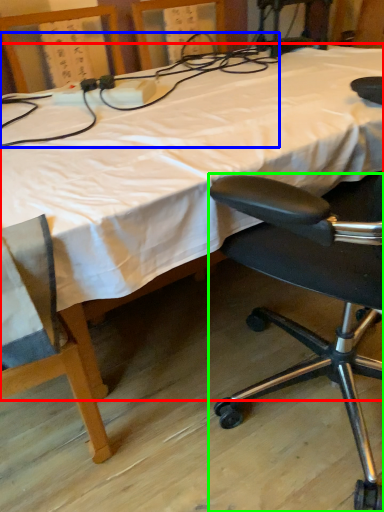
Question: Considering the real-world distances, which object is farthest from bed (highlighted by a red box)? twin (highlighted by a blue box) or chair (highlighted by a green box)?

Choices:
 (A) twin
 (B) chair

Answer: (B)